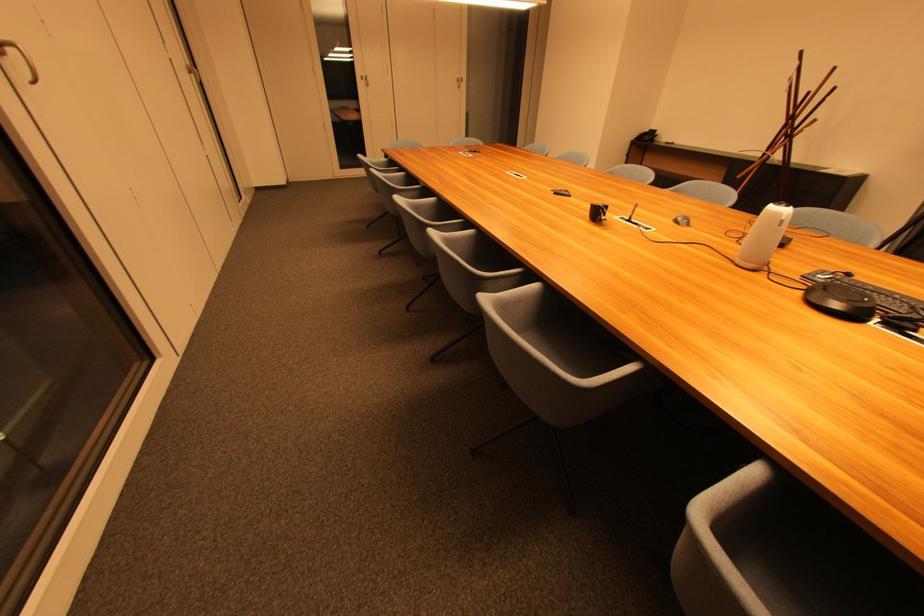
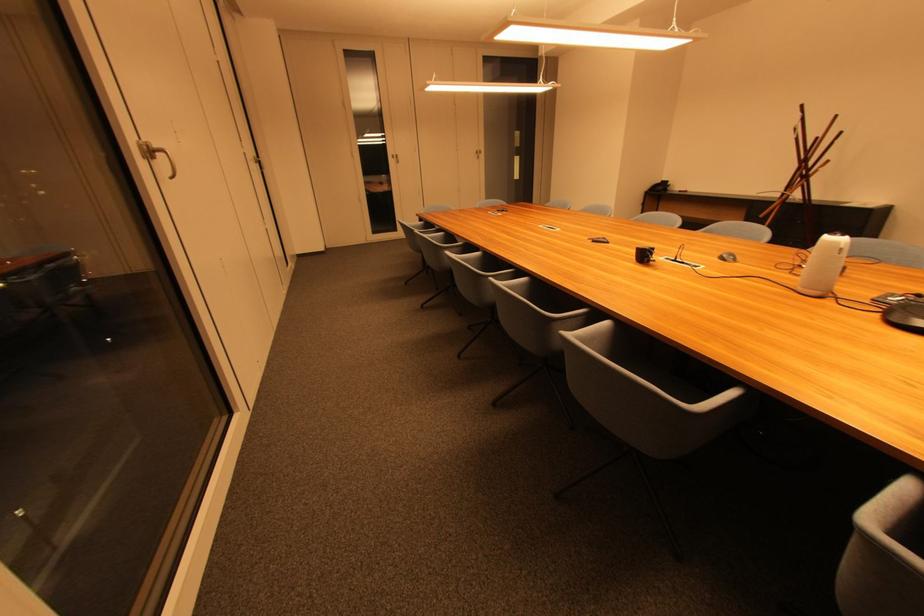
In the second image, find the point that corresponds to (x=541, y=288) in the first image.

(612, 325)